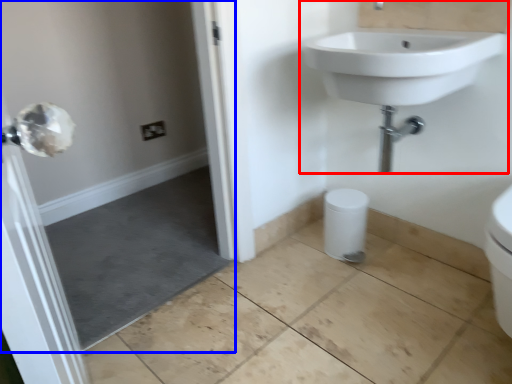
Question: Among these objects, which one is nearest to the camera, sink (highlighted by a red box) or screen door (highlighted by a blue box)?

Choices:
 (A) sink
 (B) screen door

Answer: (B)